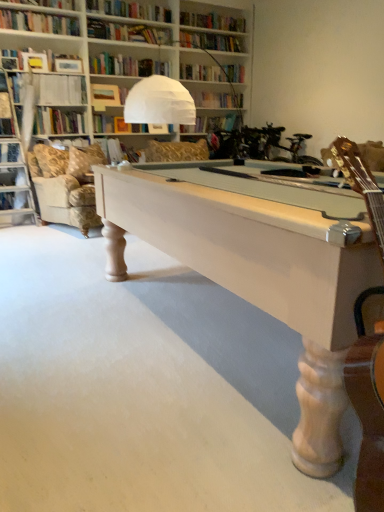
Question: From a real-world perspective, is beige fabric pillow at left located beneath white paper at upper left, arranged as the second book when ordered from the bottom?

Choices:
 (A) no
 (B) yes

Answer: (B)

Question: Would you say beige fabric pillow at left is outside white paper at upper left, the second book in the top-to-bottom sequence?

Choices:
 (A) yes
 (B) no

Answer: (A)

Question: From the image's perspective, is beige fabric pillow at left under white paper at upper left, arranged as the second book when ordered from the bottom?

Choices:
 (A) yes
 (B) no

Answer: (A)

Question: From a real-world perspective, is beige fabric pillow at left located higher than white paper at upper left, the second book in the top-to-bottom sequence?

Choices:
 (A) no
 (B) yes

Answer: (A)

Question: Considering the relative positions of beige fabric pillow at left and white paper at upper left, the second book in the top-to-bottom sequence, in the image provided, is beige fabric pillow at left in front of white paper at upper left, the second book in the top-to-bottom sequence,?

Choices:
 (A) no
 (B) yes

Answer: (B)

Question: Relative to white paper book at upper center, acting as the 1th book starting from the bottom, is white wood pool table at center in front or behind?

Choices:
 (A) behind
 (B) front

Answer: (B)

Question: Do you think white wood pool table at center is within white paper book at upper center, positioned as the 3th book in top-to-bottom order, or outside of it?

Choices:
 (A) outside
 (B) inside

Answer: (A)

Question: Is white wood pool table at center taller or shorter than white paper book at upper center, acting as the 1th book starting from the bottom?

Choices:
 (A) tall
 (B) short

Answer: (B)

Question: Considering the positions of white wood pool table at center and white paper book at upper center, acting as the 1th book starting from the bottom, in the image, is white wood pool table at center wider or thinner than white paper book at upper center, acting as the 1th book starting from the bottom,?

Choices:
 (A) thin
 (B) wide

Answer: (B)

Question: Is point (54, 163) closer or farther from the camera than point (77, 177)?

Choices:
 (A) closer
 (B) farther

Answer: (B)

Question: From the image's perspective, is light beige fabric couch at left positioned above or below beige fabric pillow at left?

Choices:
 (A) above
 (B) below

Answer: (B)

Question: Choose the correct answer: Is light beige fabric couch at left inside beige fabric pillow at left or outside it?

Choices:
 (A) outside
 (B) inside

Answer: (A)

Question: In terms of height, does light beige fabric couch at left look taller or shorter compared to beige fabric pillow at left?

Choices:
 (A) short
 (B) tall

Answer: (B)

Question: From a real-world perspective, is white wood pool table at center above or below matte brown book at upper center, which is counted as the first book, starting from the top?

Choices:
 (A) above
 (B) below

Answer: (B)

Question: From the image's perspective, relative to matte brown book at upper center, which is counted as the first book, starting from the top, is white wood pool table at center above or below?

Choices:
 (A) below
 (B) above

Answer: (A)